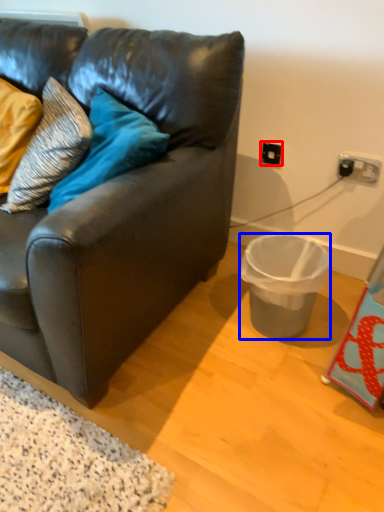
Question: Which object is closer to the camera taking this photo, electric outlet (highlighted by a red box) or trash bin/can (highlighted by a blue box)?

Choices:
 (A) electric outlet
 (B) trash bin/can

Answer: (B)